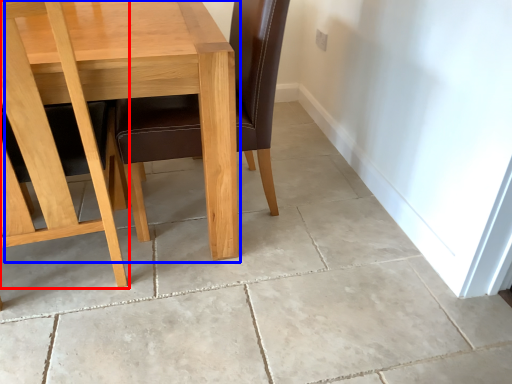
Question: Which object appears closest to the camera in this image, chair (highlighted by a red box) or table (highlighted by a blue box)?

Choices:
 (A) chair
 (B) table

Answer: (A)